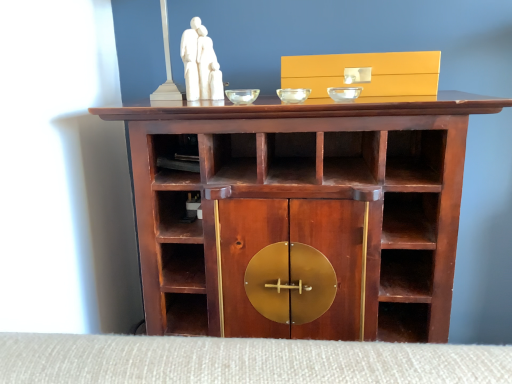
Question: Is mahogany wood cabinet at center bigger than white marble sculpture at upper center?

Choices:
 (A) yes
 (B) no

Answer: (A)

Question: Would you say mahogany wood cabinet at center contains white marble sculpture at upper center?

Choices:
 (A) yes
 (B) no

Answer: (B)

Question: From the image's perspective, would you say mahogany wood cabinet at center is positioned over white marble sculpture at upper center?

Choices:
 (A) no
 (B) yes

Answer: (A)

Question: Considering the relative positions of mahogany wood cabinet at center and white marble sculpture at upper center in the image provided, is mahogany wood cabinet at center to the left of white marble sculpture at upper center from the viewer's perspective?

Choices:
 (A) no
 (B) yes

Answer: (A)

Question: From a real-world perspective, is mahogany wood cabinet at center located higher than white marble sculpture at upper center?

Choices:
 (A) yes
 (B) no

Answer: (B)

Question: Is white marble sculpture at upper center in front of or behind transparent glass bowl at center, which ranks as the 3th glass bowl in left-to-right order, in the image?

Choices:
 (A) front
 (B) behind

Answer: (B)

Question: Looking at their shapes, would you say white marble sculpture at upper center is wider or thinner than transparent glass bowl at center, which ranks as the 3th glass bowl in left-to-right order?

Choices:
 (A) thin
 (B) wide

Answer: (B)

Question: Considering the positions of white marble sculpture at upper center and transparent glass bowl at center, acting as the first glass bowl starting from the right, in the image, is white marble sculpture at upper center taller or shorter than transparent glass bowl at center, acting as the first glass bowl starting from the right,?

Choices:
 (A) short
 (B) tall

Answer: (B)

Question: Would you say white marble sculpture at upper center is to the left or to the right of transparent glass bowl at center, acting as the first glass bowl starting from the right, in the picture?

Choices:
 (A) right
 (B) left

Answer: (B)

Question: In terms of width, does matte gold drawer at upper center look wider or thinner when compared to white marble sculpture at upper center?

Choices:
 (A) thin
 (B) wide

Answer: (B)

Question: From a real-world perspective, relative to white marble sculpture at upper center, is matte gold drawer at upper center vertically above or below?

Choices:
 (A) below
 (B) above

Answer: (A)

Question: Which is correct: matte gold drawer at upper center is inside white marble sculpture at upper center, or outside of it?

Choices:
 (A) outside
 (B) inside

Answer: (A)

Question: Is matte gold drawer at upper center in front of or behind white marble sculpture at upper center in the image?

Choices:
 (A) behind
 (B) front

Answer: (B)

Question: Looking at their shapes, would you say transparent glass bowl at center, which ranks as the 3th glass bowl in left-to-right order, is wider or thinner than transparent glass bowl at center, placed as the 1th glass bowl when sorted from left to right?

Choices:
 (A) wide
 (B) thin

Answer: (A)

Question: Considering the positions of transparent glass bowl at center, which ranks as the 3th glass bowl in left-to-right order, and transparent glass bowl at center, placed as the 1th glass bowl when sorted from left to right, in the image, is transparent glass bowl at center, which ranks as the 3th glass bowl in left-to-right order, taller or shorter than transparent glass bowl at center, placed as the 1th glass bowl when sorted from left to right,?

Choices:
 (A) tall
 (B) short

Answer: (A)